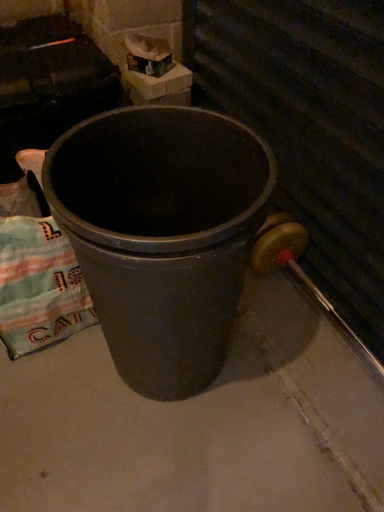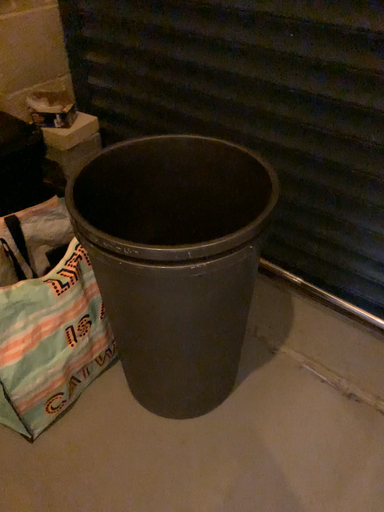
Question: How did the camera likely rotate when shooting the video?

Choices:
 (A) rotated left
 (B) rotated right

Answer: (B)